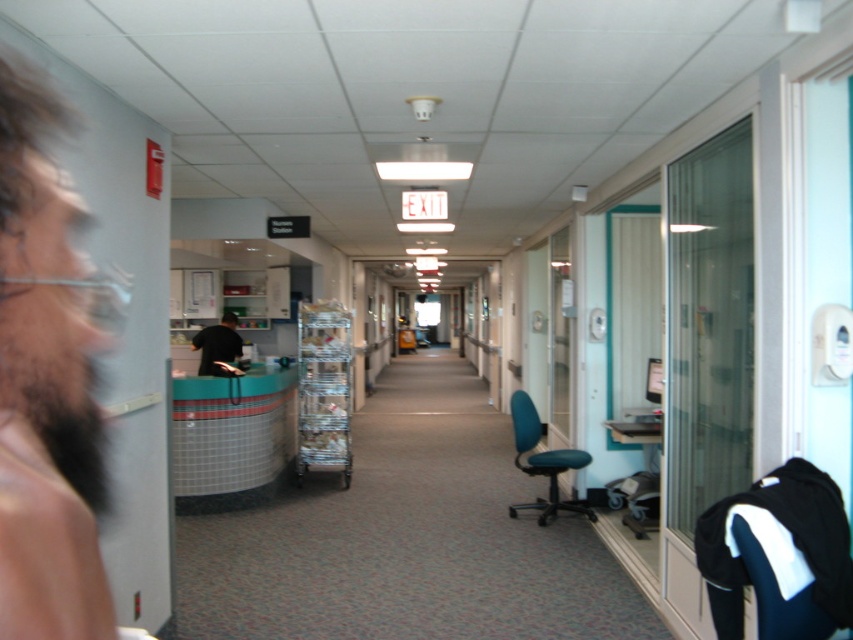
Question: Which point appears closest to the camera in this image?

Choices:
 (A) (532, 506)
 (B) (25, 93)

Answer: (B)

Question: Is brown skin at left bigger than teal fabric chair at center-right?

Choices:
 (A) yes
 (B) no

Answer: (A)

Question: Which point is farther from the camera taking this photo?

Choices:
 (A) (523, 468)
 (B) (223, 340)

Answer: (B)

Question: Can you confirm if brown skin at left is positioned to the left of black fabric swivel chair at lower right?

Choices:
 (A) yes
 (B) no

Answer: (A)

Question: Which of the following is the farthest from the observer?

Choices:
 (A) black matte shirt at center
 (B) brown skin at left
 (C) teal fabric chair at center-right
 (D) black fabric swivel chair at lower right

Answer: (A)

Question: Does black fabric swivel chair at lower right come behind black matte shirt at center?

Choices:
 (A) no
 (B) yes

Answer: (A)